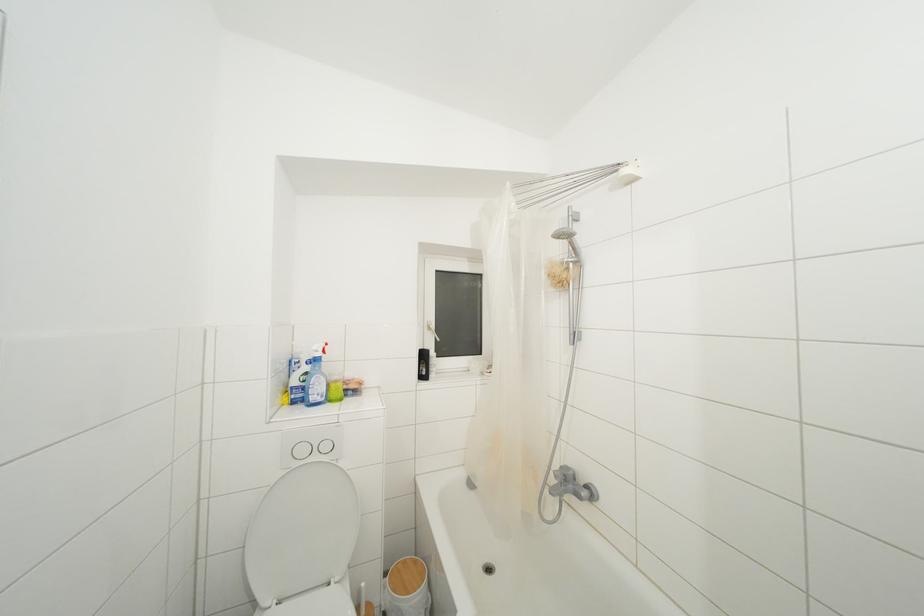
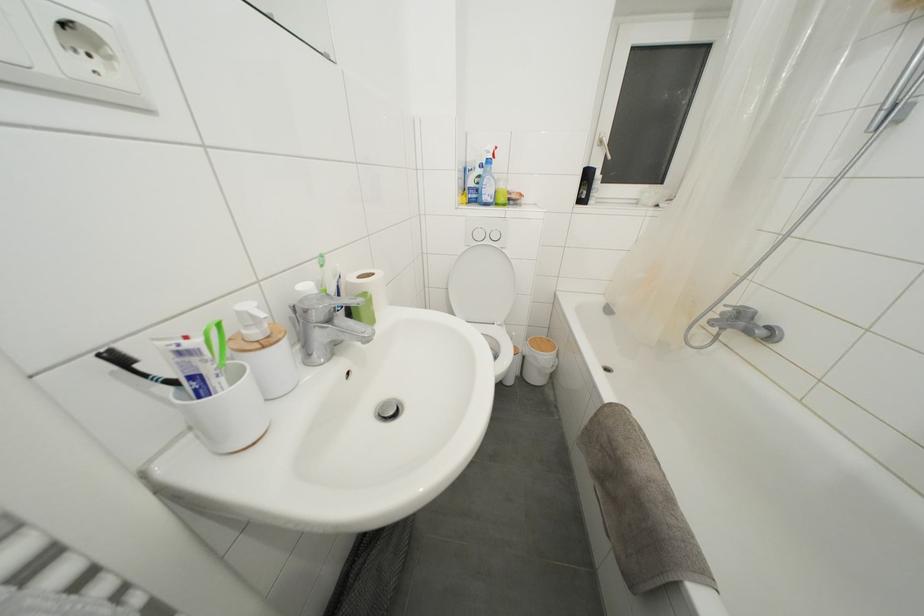
In the second image, find the point that corresponds to [408,567] in the first image.

(544, 342)